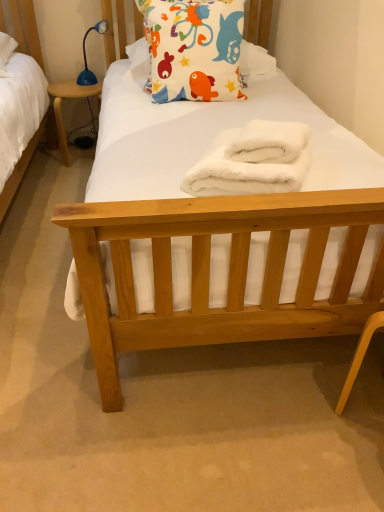
The height and width of the screenshot is (512, 384). In order to click on free location to the left of blue plastic lamp at upper left in this screenshot , I will do `click(64, 86)`.